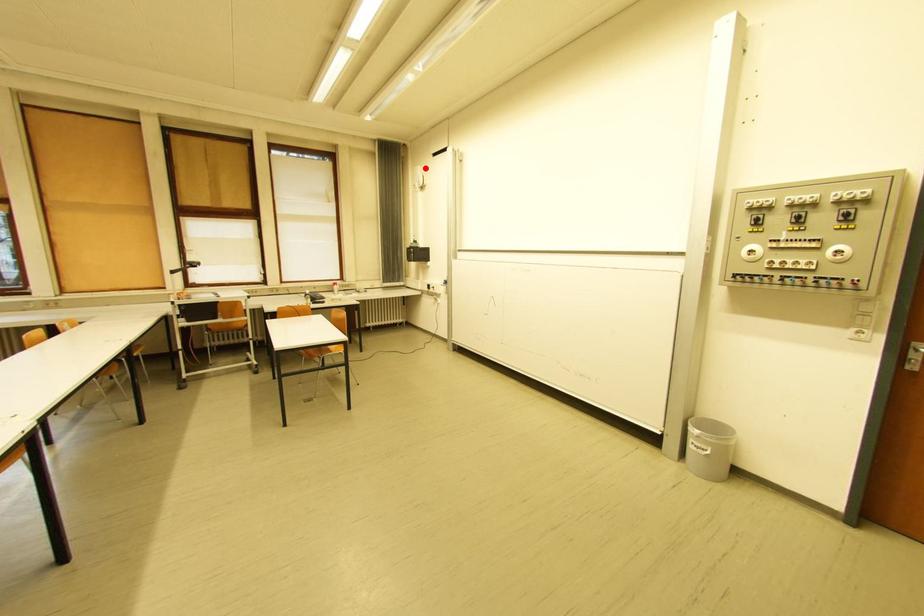
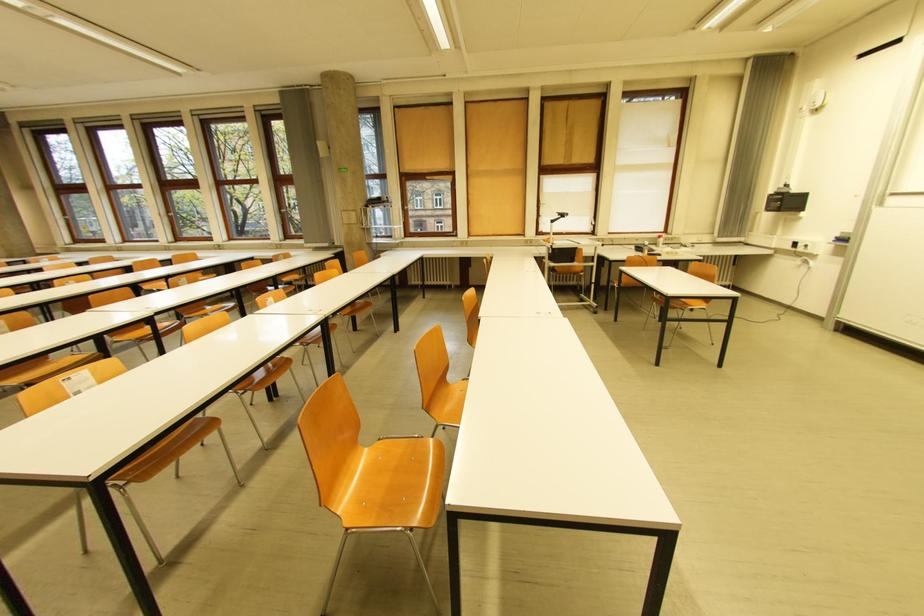
Question: I am providing you with two images of the same scene from different viewpoints. Given a red point in image1, look at the same physical point in image2. Is it:

Choices:
 (A) Closer to the viewpoint
 (B) Farther from the viewpoint

Answer: (B)